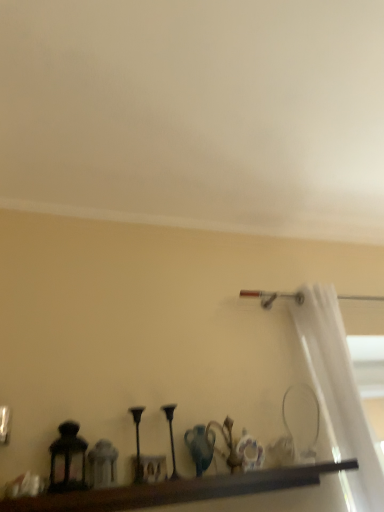
Question: Is brown wooden shelf at lower center in front of or behind matte black lantern at left in the image?

Choices:
 (A) front
 (B) behind

Answer: (A)

Question: Considering the positions of brown wooden shelf at lower center and matte black lantern at left in the image, is brown wooden shelf at lower center bigger or smaller than matte black lantern at left?

Choices:
 (A) big
 (B) small

Answer: (A)

Question: Which object is the farthest from the brown wooden shelf at lower center?

Choices:
 (A) matte black lantern at left
 (B) white sheer curtain at right

Answer: (B)

Question: Which of these objects is positioned closest to the matte black lantern at left?

Choices:
 (A) white sheer curtain at right
 (B) brown wooden shelf at lower center

Answer: (B)